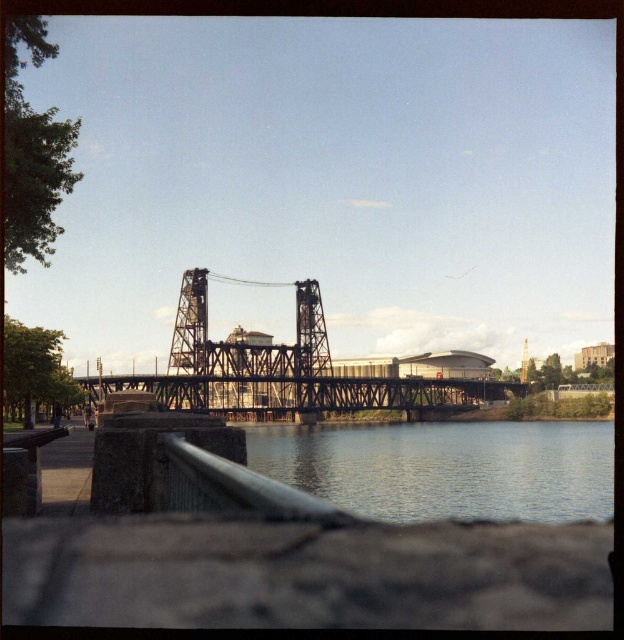
Who is lower down, clear water at lower center or metallic steel bridge at center?

clear water at lower center is lower down.

Where is `clear water at lower center`? The width and height of the screenshot is (624, 640). clear water at lower center is located at coordinates (446, 467).

The width and height of the screenshot is (624, 640). Describe the element at coordinates (446, 467) in the screenshot. I see `clear water at lower center` at that location.

Find the location of `clear water at lower center`. clear water at lower center is located at coordinates (446, 467).

Is point (321, 355) closer to camera compared to point (134, 387)?

No, it is not.

Does black steel suspension bridge at center have a smaller size compared to metallic steel bridge at center?

No.

The height and width of the screenshot is (640, 624). Describe the element at coordinates (285, 369) in the screenshot. I see `black steel suspension bridge at center` at that location.

This screenshot has width=624, height=640. I want to click on black steel suspension bridge at center, so click(x=285, y=369).

Is clear water at lower center bigger than black steel suspension bridge at center?

Incorrect, clear water at lower center is not larger than black steel suspension bridge at center.

Between point (517, 444) and point (203, 273), which one is positioned behind?

Positioned behind is point (517, 444).

Does point (499, 493) lie behind point (328, 356)?

That is False.

Find the location of a particular element. clear water at lower center is located at coordinates (446, 467).